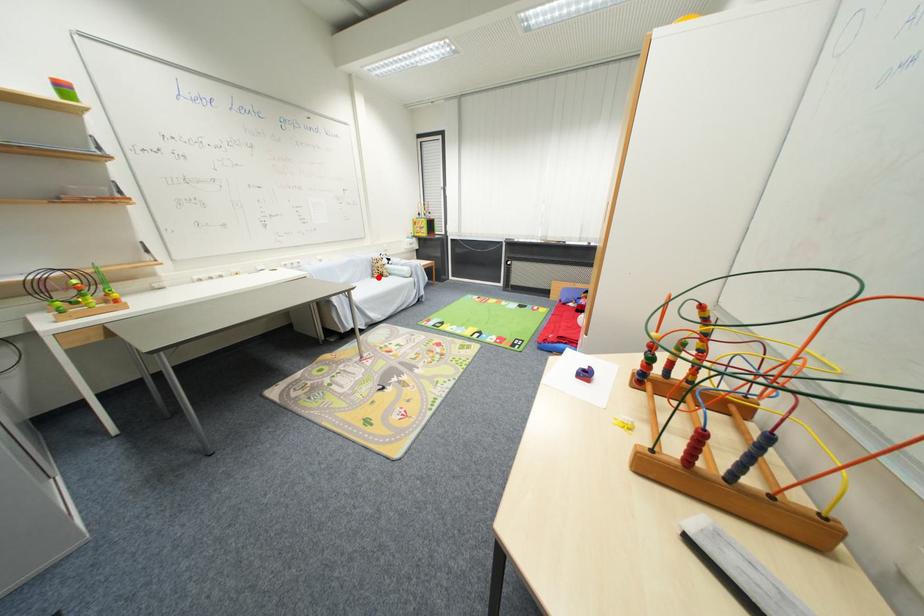
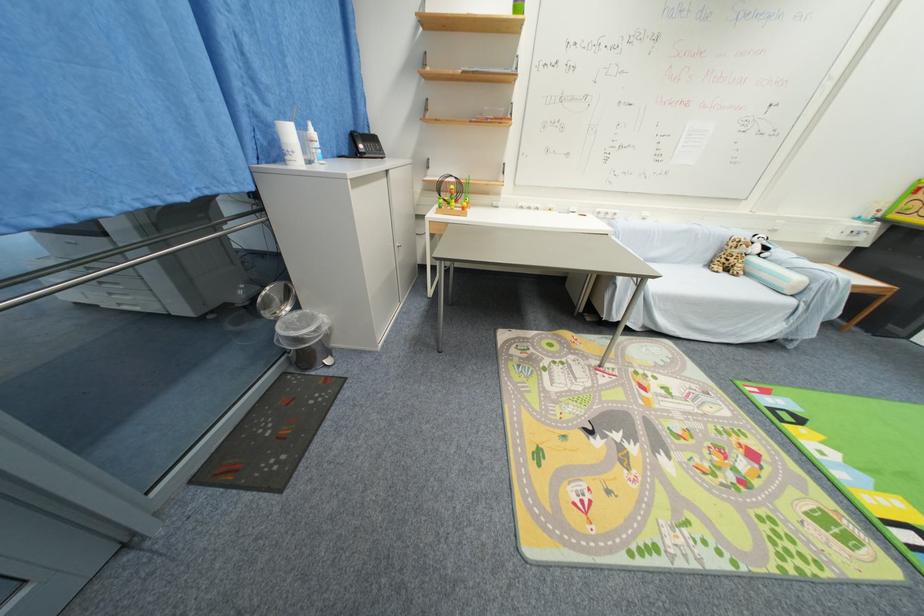
In the second image, find the point that corresponds to the highlighted location in the first image.

(714, 265)